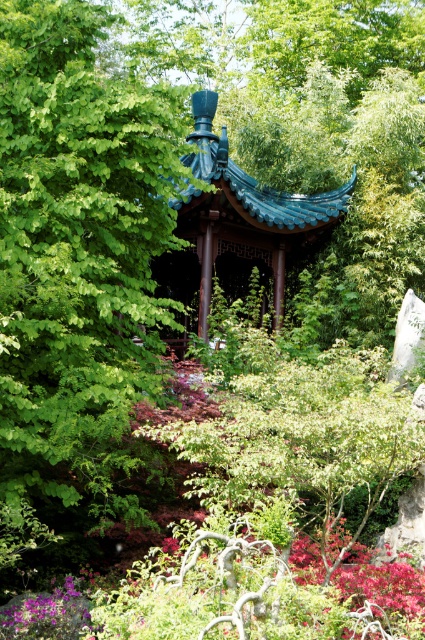
You are a gardener who wants to plant a new flower in the garden. You have a matte purple flower at center and a teal glazed gazebo at center in your view. Which object is closer to you?

The matte purple flower at center is closer to you as it is in front of the teal glazed gazebo at center.

You are a gardener planning to plant a new shrub that requires a space of 1.2 meters in diameter. You see the green glossy tree at center and the matte purple flower at center. Which object currently occupies a larger area, and would the shrub fit between them?

The green glossy tree at center is bigger than the matte purple flower at center. Since the shrub requires 1.2 meters in diameter, it might not fit between them if the existing plants already occupy that space. Check the exact dimensions of the area between the two plants to ensure there is enough room.

You are planning to place a large decorative fountain in the garden. The fountain requires a space wider than the green glossy tree at center. Can the space where the teal glazed gazebo at center is located accommodate the fountain?

The green glossy tree at center has a lesser width compared to teal glazed gazebo at center. Since the fountain requires a space wider than the green glossy tree at center, the space at the teal glazed gazebo at center can accommodate the fountain because it is wider.